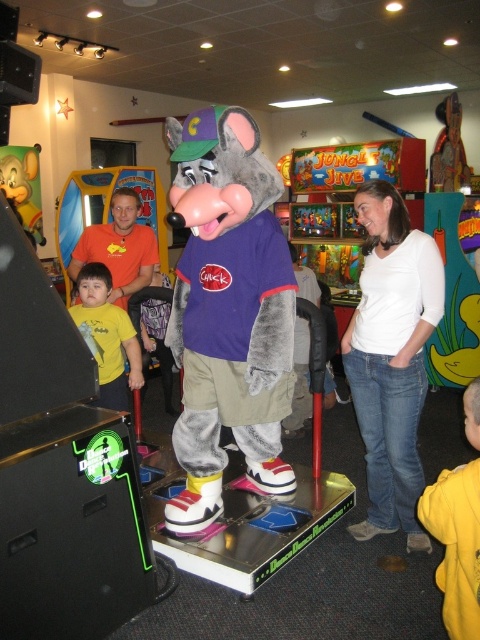
Is plush gray mouse at center to the left of matte yellow plush mouse at left from the viewer's perspective?

Incorrect, plush gray mouse at center is not on the left side of matte yellow plush mouse at left.

Can you confirm if plush gray mouse at center is bigger than matte yellow plush mouse at left?

Indeed, plush gray mouse at center has a larger size compared to matte yellow plush mouse at left.

At what (x,y) coordinates should I click in order to perform the action: click on plush gray mouse at center. Please return your answer as a coordinate pair (x, y). This screenshot has width=480, height=640. Looking at the image, I should click on (228, 312).

At what (x,y) coordinates should I click in order to perform the action: click on white cotton shirt at center. Please return your answer as a coordinate pair (x, y). The height and width of the screenshot is (640, 480). Looking at the image, I should click on (392, 356).

Does white cotton shirt at center appear under yellow fleece jacket at lower right?

Incorrect, white cotton shirt at center is not positioned below yellow fleece jacket at lower right.

You are a GUI agent. You are given a task and a screenshot of the screen. Output one action in this format:
    pyautogui.click(x=<x>, y=<y>)
    Task: Click on the white cotton shirt at center
    The height and width of the screenshot is (640, 480).
    Given the screenshot: What is the action you would take?
    pyautogui.click(x=392, y=356)

Does yellow matte shirt at left have a smaller size compared to matte yellow plush mouse at left?

Correct, yellow matte shirt at left occupies less space than matte yellow plush mouse at left.

What do you see at coordinates (107, 336) in the screenshot? The image size is (480, 640). I see `yellow matte shirt at left` at bounding box center [107, 336].

Who is more forward, (80, 291) or (1, 180)?

Positioned in front is point (80, 291).

Locate an element on the screen. yellow matte shirt at left is located at coordinates coord(107,336).